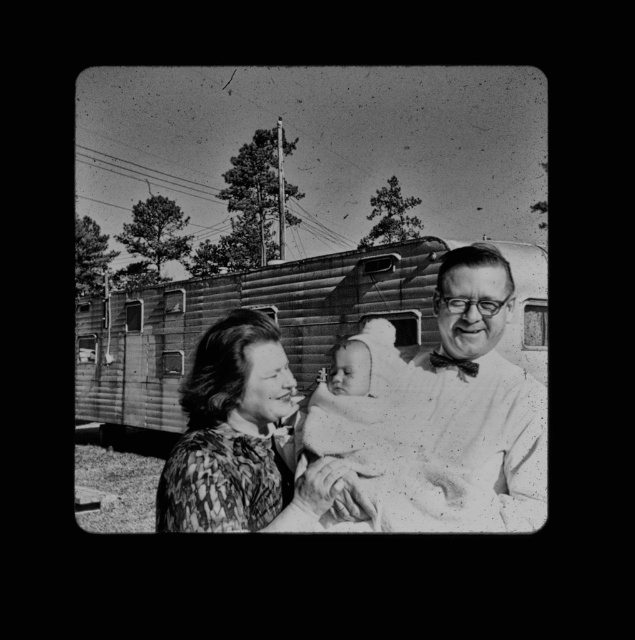
Question: Observing the image, what is the correct spatial positioning of wooden trailer at center in reference to patterned fabric woman at center?

Choices:
 (A) left
 (B) right

Answer: (A)

Question: Is smooth white shirt at center below wooden trailer at center?

Choices:
 (A) yes
 (B) no

Answer: (A)

Question: Among these objects, which one is farthest from the camera?

Choices:
 (A) wooden trailer at center
 (B) smooth white shirt at center

Answer: (A)

Question: Which of the following is the farthest from the observer?

Choices:
 (A) patterned fabric woman at center
 (B) wooden trailer at center

Answer: (B)

Question: Which object is positioned farthest from the wooden trailer at center?

Choices:
 (A) smooth white shirt at center
 (B) patterned fabric woman at center

Answer: (B)

Question: Can you confirm if smooth white shirt at center is positioned below patterned fabric woman at center?

Choices:
 (A) no
 (B) yes

Answer: (A)